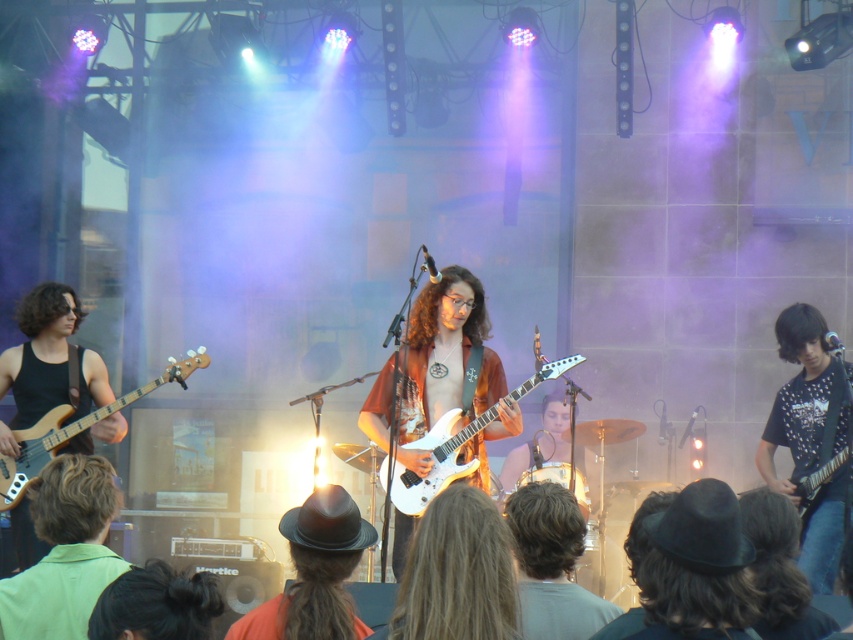
You are a photographer at the concert and want to capture a photo of the black felt hat at center and the shiny black electric guitar at right. Based on their positions, which object should you focus on first if you want to ensure both are in the same focal plane?

The black felt hat at center is below shiny black electric guitar at right, so you should focus on the shiny black electric guitar at right first to ensure both are in the same focal plane.